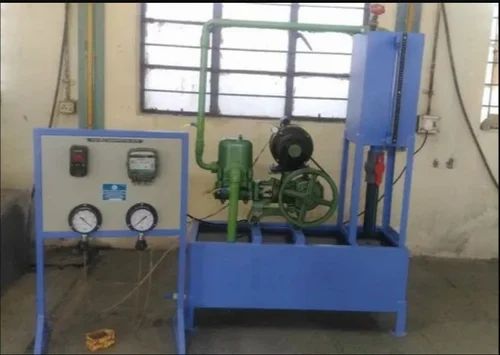
The height and width of the screenshot is (355, 500). I want to click on window, so click(252, 36), click(491, 97).